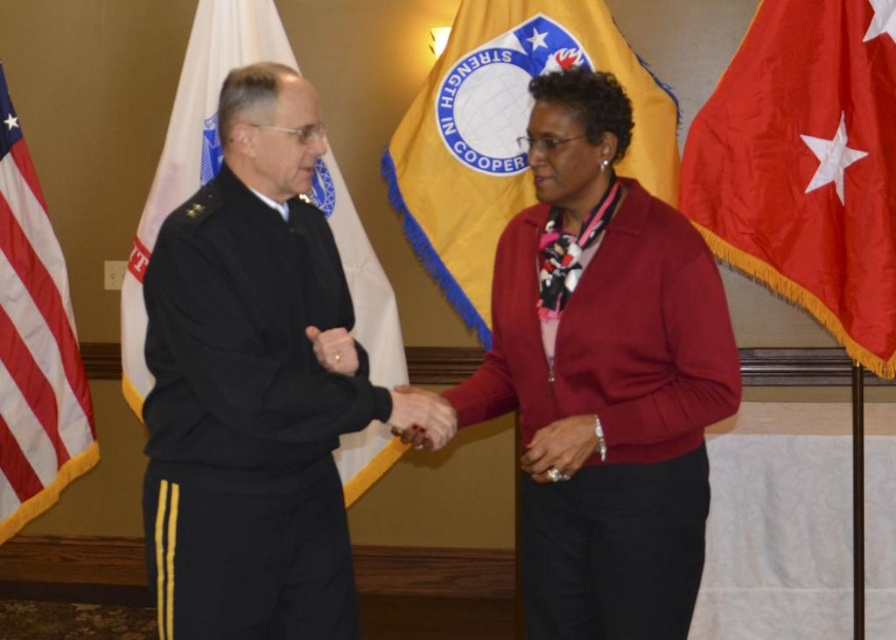
You are a photographer at a formal event. You need to capture a photo of the black uniform at center and the white fabric flag at left. Based on their positions, which object is closer to the left edge of the image?

The white fabric flag at left is closer to the left edge of the image because the black uniform at center is to the right of it.

In the image, there is a red fabric flag at right represented by point (806, 164). Where is this point located relative to the American flag on the far left?

The point (806, 164) representing the red fabric flag at right is located to the right of the American flag on the far left.

You are an event planner arranging a ceremony. You need to place a large banner between the red fabric flag at right and the white fabric flag at left. Which flag should the banner be closer to if it needs to be closer to the larger flag?

The white fabric flag at left is larger than the red fabric flag at right, so the banner should be placed closer to the white fabric flag at left.